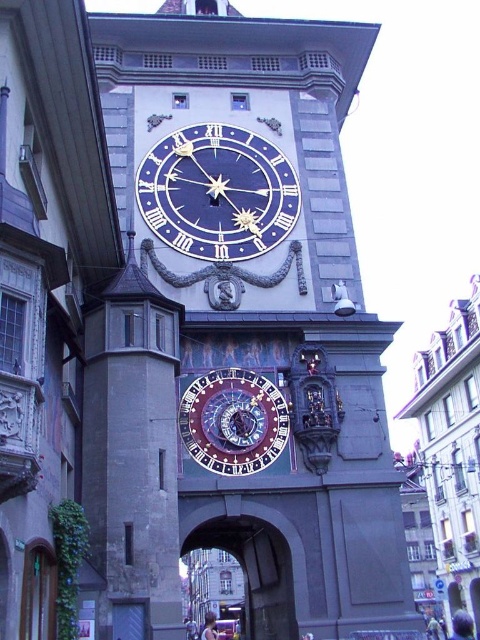
Measure the distance from polished brass clock at center to stone archway at center.

polished brass clock at center is 14.93 meters away from stone archway at center.

From the picture: Is polished brass clock at center bigger than stone archway at center?

Actually, polished brass clock at center might be smaller than stone archway at center.

Between point (228, 452) and point (204, 531), which one is positioned behind?

The point (204, 531) is more distant.

Find the location of `polished brass clock at center`. polished brass clock at center is located at coordinates (232, 420).

Who is shorter, stone clock tower at center or stone archway at center?

With less height is stone archway at center.

Is point (111, 369) closer to camera compared to point (237, 516)?

That is True.

The height and width of the screenshot is (640, 480). What do you see at coordinates (243, 323) in the screenshot?
I see `stone clock tower at center` at bounding box center [243, 323].

Find the location of `stone clock tower at center`. stone clock tower at center is located at coordinates 243,323.

Who is more distant from viewer, (241, 202) or (255, 605)?

The point (255, 605) is more distant.

Is point (154, 148) positioned after point (220, 540)?

No, it is not.

What do you see at coordinates (217, 193) in the screenshot? The width and height of the screenshot is (480, 640). I see `blue painted metal clock at center` at bounding box center [217, 193].

Where is `blue painted metal clock at center`? blue painted metal clock at center is located at coordinates (217, 193).